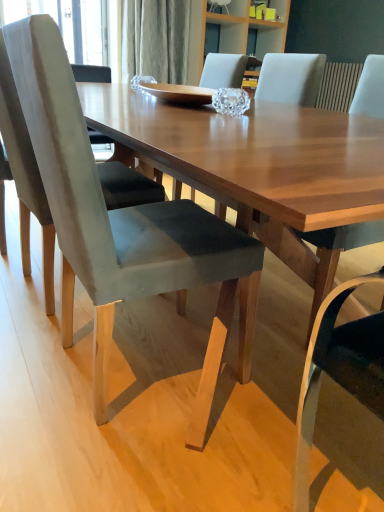
You are a GUI agent. You are given a task and a screenshot of the screen. Output one action in this format:
    pyautogui.click(x=<x>, y=<y>)
    Task: Click on the suede gray chair at left, the 3th chair from the right
    
    Given the screenshot: What is the action you would take?
    pyautogui.click(x=25, y=173)

What is the approximate height of suede gray chair at left, the 3th chair from the right?

It is 37.76 inches.

I want to click on suede gray chair at left, positioned as the first chair in left-to-right order, so click(25, 173).

Between suede gray chair at left, positioned as the first chair in left-to-right order, and velvet gray chair at center, positioned as the 2th chair in left-to-right order, which one has larger size?

With larger size is velvet gray chair at center, positioned as the 2th chair in left-to-right order.

Are suede gray chair at left, positioned as the first chair in left-to-right order, and velvet gray chair at center, marked as the 2th chair in a right-to-left arrangement, beside each other?

No, suede gray chair at left, positioned as the first chair in left-to-right order, is not touching velvet gray chair at center, marked as the 2th chair in a right-to-left arrangement.

Is suede gray chair at left, positioned as the first chair in left-to-right order, facing towards velvet gray chair at center, marked as the 2th chair in a right-to-left arrangement?

No.

Is velvet gray chair at center, marked as the 2th chair in a right-to-left arrangement, surrounding matte gray chair at center, which is the first chair in right-to-left order?

No, matte gray chair at center, which is the first chair in right-to-left order, is not a part of velvet gray chair at center, marked as the 2th chair in a right-to-left arrangement.

How far apart are velvet gray chair at center, marked as the 2th chair in a right-to-left arrangement, and matte gray chair at center, the third chair when ordered from left to right?

velvet gray chair at center, marked as the 2th chair in a right-to-left arrangement, and matte gray chair at center, the third chair when ordered from left to right, are 20.09 inches apart.

Considering the positions of objects velvet gray chair at center, marked as the 2th chair in a right-to-left arrangement, and matte gray chair at center, the third chair when ordered from left to right, in the image provided, who is in front, velvet gray chair at center, marked as the 2th chair in a right-to-left arrangement, or matte gray chair at center, the third chair when ordered from left to right,?

velvet gray chair at center, marked as the 2th chair in a right-to-left arrangement, is closer to the camera.

In terms of height, does velvet gray chair at center, positioned as the 2th chair in left-to-right order, look taller or shorter compared to matte gray chair at center, the third chair when ordered from left to right?

Clearly, velvet gray chair at center, positioned as the 2th chair in left-to-right order, is taller compared to matte gray chair at center, the third chair when ordered from left to right.

Is matte gray chair at center, which is the first chair in right-to-left order, oriented away from suede gray chair at left, the 3th chair from the right?

No, suede gray chair at left, the 3th chair from the right, is not at the back of matte gray chair at center, which is the first chair in right-to-left order.

Which is farther, [271,243] or [40,209]?

Point [40,209]

Which chair is the 1st one when counting from the front of the suede gray chair at left, positioned as the first chair in left-to-right order? Please provide its 2D coordinates.

[(316, 252)]

Is suede gray chair at left, positioned as the first chair in left-to-right order, oriented away from matte gray chair at center, the third chair when ordered from left to right?

No.

Consider the image. Would you say suede gray chair at left, positioned as the first chair in left-to-right order, is inside or outside matte gray chair at center, which is the first chair in right-to-left order?

suede gray chair at left, positioned as the first chair in left-to-right order, cannot be found inside matte gray chair at center, which is the first chair in right-to-left order.

Is suede gray chair at left, the 3th chair from the right, with matte gray chair at center, which is the first chair in right-to-left order?

suede gray chair at left, the 3th chair from the right, is not next to matte gray chair at center, which is the first chair in right-to-left order, and they're not touching.

Considering the positions of objects suede gray chair at left, positioned as the first chair in left-to-right order, and matte gray chair at center, which is the first chair in right-to-left order, in the image provided, who is in front, suede gray chair at left, positioned as the first chair in left-to-right order, or matte gray chair at center, which is the first chair in right-to-left order,?

matte gray chair at center, which is the first chair in right-to-left order, is in front.

Between point (253, 253) and point (148, 191), which one is positioned in front?

Positioned in front is point (253, 253).

From a real-world perspective, which object stands above the other?

suede gray chair at left, positioned as the first chair in left-to-right order, is physically above.

Does velvet gray chair at center, positioned as the 2th chair in left-to-right order, appear on the right side of suede gray chair at left, positioned as the first chair in left-to-right order?

Yes, velvet gray chair at center, positioned as the 2th chair in left-to-right order, is to the right of suede gray chair at left, positioned as the first chair in left-to-right order.

Based on the photo, looking at their sizes, would you say velvet gray chair at center, marked as the 2th chair in a right-to-left arrangement, is wider or thinner than suede gray chair at left, the 3th chair from the right?

velvet gray chair at center, marked as the 2th chair in a right-to-left arrangement, is thinner than suede gray chair at left, the 3th chair from the right.

Consider the image. Which is more to the left, matte gray chair at center, the third chair when ordered from left to right, or velvet gray chair at center, marked as the 2th chair in a right-to-left arrangement?

velvet gray chair at center, marked as the 2th chair in a right-to-left arrangement.

Considering the relative sizes of matte gray chair at center, the third chair when ordered from left to right, and velvet gray chair at center, marked as the 2th chair in a right-to-left arrangement, in the image provided, is matte gray chair at center, the third chair when ordered from left to right, bigger than velvet gray chair at center, marked as the 2th chair in a right-to-left arrangement,?

No, matte gray chair at center, the third chair when ordered from left to right, is not bigger than velvet gray chair at center, marked as the 2th chair in a right-to-left arrangement.

Between point (363, 71) and point (201, 270), which one is positioned behind?

The point (363, 71) is farther from the camera.

I want to click on chair on the left side of velvet gray chair at center, positioned as the 2th chair in left-to-right order, so click(x=25, y=173).

I want to click on chair below the matte gray chair at center, which is the first chair in right-to-left order (from the image's perspective), so pos(118,220).

From the image, which object appears to be nearer to suede gray chair at left, the 3th chair from the right, velvet gray chair at center, positioned as the 2th chair in left-to-right order, or matte gray chair at center, which is the first chair in right-to-left order?

Among the two, velvet gray chair at center, positioned as the 2th chair in left-to-right order, is located nearer to suede gray chair at left, the 3th chair from the right.

Estimate the real-world distances between objects in this image. Which object is further from suede gray chair at left, positioned as the first chair in left-to-right order, matte gray chair at center, the third chair when ordered from left to right, or velvet gray chair at center, positioned as the 2th chair in left-to-right order?

matte gray chair at center, the third chair when ordered from left to right.

Considering their positions, is matte gray chair at center, the third chair when ordered from left to right, positioned further to velvet gray chair at center, positioned as the 2th chair in left-to-right order, than suede gray chair at left, positioned as the first chair in left-to-right order?

matte gray chair at center, the third chair when ordered from left to right.

When comparing their distances from matte gray chair at center, which is the first chair in right-to-left order, does velvet gray chair at center, positioned as the 2th chair in left-to-right order, or suede gray chair at left, the 3th chair from the right, seem further?

Among the two, suede gray chair at left, the 3th chair from the right, is located further to matte gray chair at center, which is the first chair in right-to-left order.

From the image, which object appears to be farther from velvet gray chair at center, positioned as the 2th chair in left-to-right order, suede gray chair at left, the 3th chair from the right, or matte gray chair at center, the third chair when ordered from left to right?

The object further to velvet gray chair at center, positioned as the 2th chair in left-to-right order, is matte gray chair at center, the third chair when ordered from left to right.

From the image, which object appears to be farther from matte gray chair at center, the third chair when ordered from left to right, suede gray chair at left, positioned as the first chair in left-to-right order, or velvet gray chair at center, marked as the 2th chair in a right-to-left arrangement?

The object further to matte gray chair at center, the third chair when ordered from left to right, is suede gray chair at left, positioned as the first chair in left-to-right order.

You are a GUI agent. You are given a task and a screenshot of the screen. Output one action in this format:
    pyautogui.click(x=<x>, y=<y>)
    Task: Click on the chair situated between suede gray chair at left, positioned as the first chair in left-to-right order, and matte gray chair at center, the third chair when ordered from left to right, from left to right
    The image size is (384, 512).
    Given the screenshot: What is the action you would take?
    pyautogui.click(x=118, y=220)